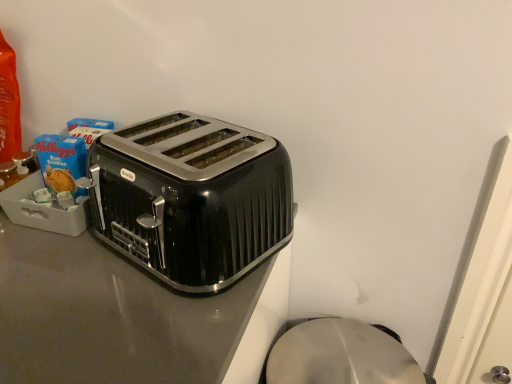
The image size is (512, 384). In order to click on vacant area that lies in front of black metallic toaster at center in this screenshot , I will do `click(130, 326)`.